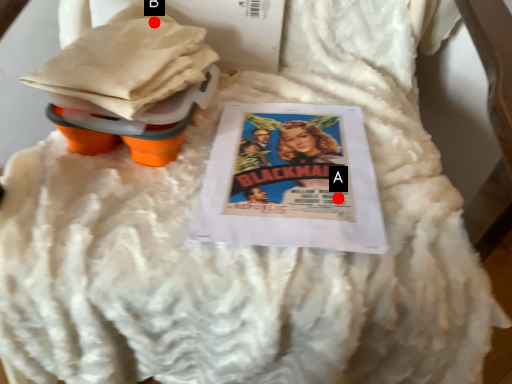
Question: Two points are circled on the image, labeled by A and B beside each circle. Which point is farther to the camera?

Choices:
 (A) A is further
 (B) B is further

Answer: (B)